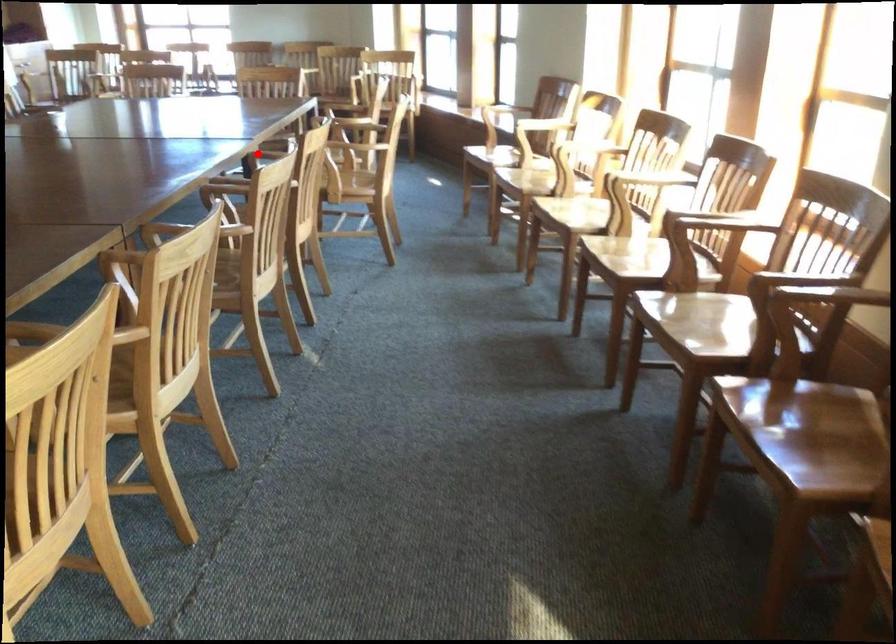
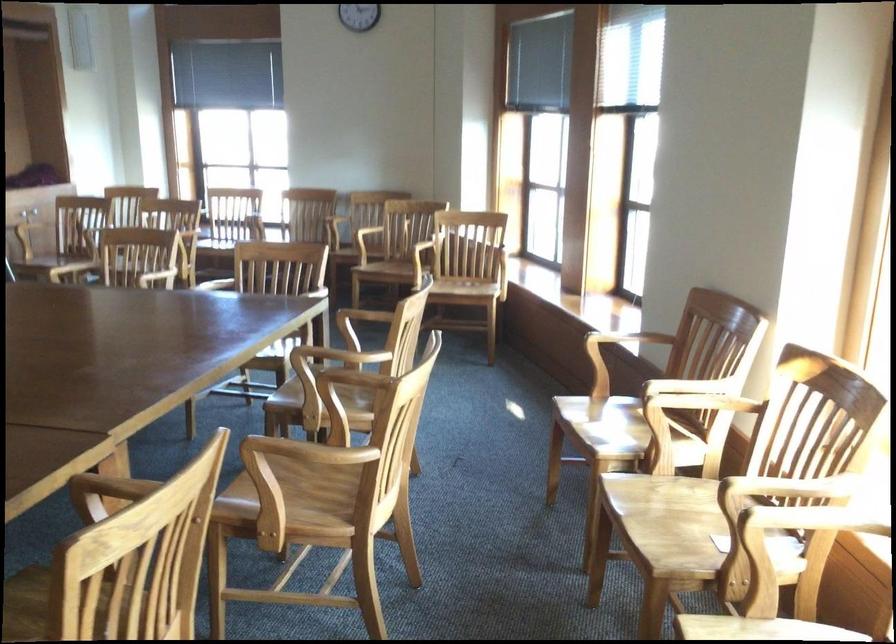
Question: I am providing you with two images of the same scene from different viewpoints. A red point is marked on the first image. Can you still see the location of the red point in image 2?

Choices:
 (A) Yes
 (B) No

Answer: (A)